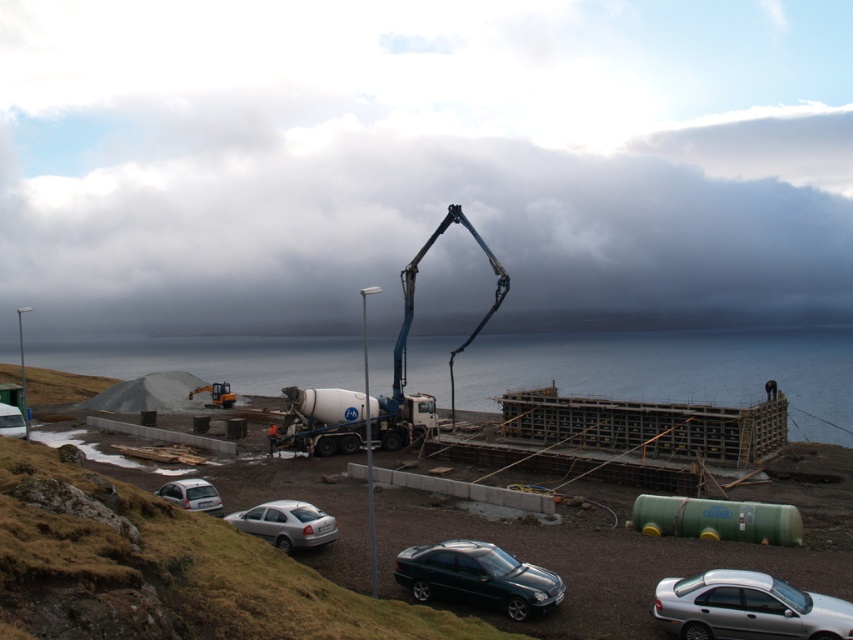
Question: Which point appears farthest from the camera in this image?

Choices:
 (A) (686, 621)
 (B) (221, 602)
 (C) (184, 486)
 (D) (300, 516)

Answer: (C)

Question: Which is farther from the shiny black sedan at center?

Choices:
 (A) silver metallic car at lower left
 (B) cloudy sky at upper center
 (C) silver metallic sedan at lower center
 (D) silver metallic car at lower right

Answer: (B)

Question: Which point appears closest to the camera in this image?

Choices:
 (A) (763, 259)
 (B) (460, 582)

Answer: (B)

Question: Can you confirm if dark blue water at center is positioned above white matte hatchback at lower left?

Choices:
 (A) no
 (B) yes

Answer: (B)

Question: Can you confirm if cloudy sky at upper center is positioned to the left of white matte hatchback at lower left?

Choices:
 (A) no
 (B) yes

Answer: (A)

Question: Where is cloudy sky at upper center located in relation to white matte hatchback at lower left in the image?

Choices:
 (A) left
 (B) right

Answer: (B)